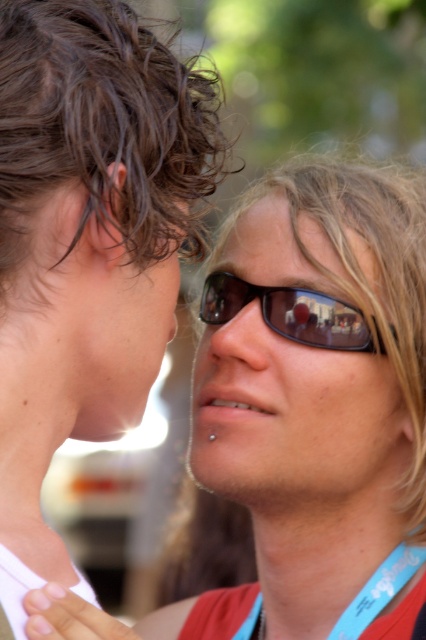
Based on the photo, based on the scene description, which object is taller, the matte skin at center or the matte black nose at center?

The matte skin at center is much taller than the matte black nose at center according to the description.

You are taking a photo of the two people in the scene. You want to focus on the person closer to the camera. Which point should you focus on, point (255, 340) or point (393, 566)?

Point (255, 340) is closer to the camera than point (393, 566), so you should focus on point (255, 340).